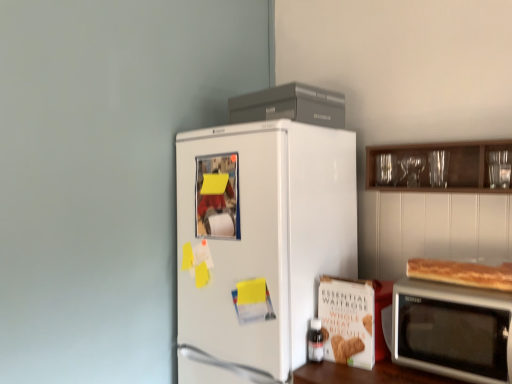
What do you see at coordinates (453, 330) in the screenshot?
I see `satin silver microwave at lower right` at bounding box center [453, 330].

The height and width of the screenshot is (384, 512). Describe the element at coordinates (462, 273) in the screenshot. I see `golden brown crusty bread at right` at that location.

Where is `matte glass bottle at lower center`? Image resolution: width=512 pixels, height=384 pixels. matte glass bottle at lower center is located at coordinates (315, 341).

From their relative heights in the image, would you say transparent glassware at upper right is taller or shorter than golden brown crusty bread at right?

transparent glassware at upper right is taller than golden brown crusty bread at right.

From a real-world perspective, is transparent glassware at upper right positioned above or below golden brown crusty bread at right?

From a real-world perspective, transparent glassware at upper right is physically above golden brown crusty bread at right.

Is transparent glassware at upper right inside the boundaries of golden brown crusty bread at right, or outside?

transparent glassware at upper right is outside golden brown crusty bread at right.

Would you say transparent glassware at upper right is a long distance from golden brown crusty bread at right?

No.

Which of these two, matte glass bottle at lower center or white matte refrigerator at center, is thinner?

Thinner between the two is matte glass bottle at lower center.

Is matte glass bottle at lower center bigger than white matte refrigerator at center?

No, matte glass bottle at lower center is not bigger than white matte refrigerator at center.

You are a GUI agent. You are given a task and a screenshot of the screen. Output one action in this format:
    pyautogui.click(x=<x>, y=<y>)
    Task: Click on the bottle below the white matte refrigerator at center (from a real-world perspective)
    This screenshot has width=512, height=384.
    Given the screenshot: What is the action you would take?
    pyautogui.click(x=315, y=341)

From the image's perspective, who appears lower, matte glass bottle at lower center or white matte refrigerator at center?

matte glass bottle at lower center appears lower in the image.

Is matte glass bottle at lower center outside of satin silver microwave at lower right?

That's correct, matte glass bottle at lower center is outside of satin silver microwave at lower right.

Which is less distant, (310, 354) or (504, 380)?

Point (310, 354) is farther from the camera than point (504, 380).

Considering the relative sizes of matte glass bottle at lower center and satin silver microwave at lower right in the image provided, is matte glass bottle at lower center wider than satin silver microwave at lower right?

No.

Is matte glass bottle at lower center to the right of transparent glassware at upper right from the viewer's perspective?

No.

From a real-world perspective, is matte glass bottle at lower center above or below transparent glassware at upper right?

matte glass bottle at lower center is below transparent glassware at upper right.

Which object is more forward, matte glass bottle at lower center or transparent glassware at upper right?

transparent glassware at upper right.

From the image's perspective, does matte glass bottle at lower center appear higher than transparent glassware at upper right?

Actually, matte glass bottle at lower center appears below transparent glassware at upper right in the image.

Choose the correct answer: Is white matte refrigerator at center inside golden brown crusty bread at right or outside it?

white matte refrigerator at center is not enclosed by golden brown crusty bread at right.

Could you tell me if white matte refrigerator at center is turned towards golden brown crusty bread at right?

No, white matte refrigerator at center does not turn towards golden brown crusty bread at right.

Is white matte refrigerator at center touching golden brown crusty bread at right?

white matte refrigerator at center and golden brown crusty bread at right are clearly separated.

Which of these two, golden brown crusty bread at right or satin silver microwave at lower right, is thinner?

With smaller width is golden brown crusty bread at right.

Relative to satin silver microwave at lower right, is golden brown crusty bread at right in front or behind?

In the image, golden brown crusty bread at right appears behind satin silver microwave at lower right.

From the image's perspective, which is below, golden brown crusty bread at right or satin silver microwave at lower right?

satin silver microwave at lower right appears lower in the image.

Image resolution: width=512 pixels, height=384 pixels. Identify the location of microwave oven that appears on the left of golden brown crusty bread at right. (453, 330).

Who is shorter, satin silver microwave at lower right or transparent glassware at upper right?

transparent glassware at upper right is shorter.

Is there a large distance between satin silver microwave at lower right and transparent glassware at upper right?

No.

From the image's perspective, between satin silver microwave at lower right and transparent glassware at upper right, who is located below?

From the image's view, satin silver microwave at lower right is below.

Can you tell me how much satin silver microwave at lower right and transparent glassware at upper right differ in facing direction?

2.78 degrees.

I want to click on food below the transparent glassware at upper right (from the image's perspective), so click(462, 273).

The image size is (512, 384). Find the location of `refrigerator above the matte glass bottle at lower center (from the image's perspective)`. refrigerator above the matte glass bottle at lower center (from the image's perspective) is located at coordinates (260, 240).

When comparing their distances from white matte refrigerator at center, does golden brown crusty bread at right or matte glass bottle at lower center seem further?

golden brown crusty bread at right is positioned further to the anchor white matte refrigerator at center.

Looking at the image, which one is located further to matte glass bottle at lower center, white matte refrigerator at center or transparent glassware at upper right?

transparent glassware at upper right lies further to matte glass bottle at lower center than the other object.

When comparing their distances from transparent glassware at upper right, does matte glass bottle at lower center or satin silver microwave at lower right seem further?

matte glass bottle at lower center lies further to transparent glassware at upper right than the other object.

When comparing their distances from transparent glassware at upper right, does white matte refrigerator at center or satin silver microwave at lower right seem closer?

Among the two, satin silver microwave at lower right is located nearer to transparent glassware at upper right.

From the image, which object appears to be farther from golden brown crusty bread at right, transparent glassware at upper right or satin silver microwave at lower right?

transparent glassware at upper right is further to golden brown crusty bread at right.

Considering their positions, is matte glass bottle at lower center positioned closer to white matte refrigerator at center than transparent glassware at upper right?

matte glass bottle at lower center lies closer to white matte refrigerator at center than the other object.

Based on their spatial positions, is matte glass bottle at lower center or satin silver microwave at lower right further from golden brown crusty bread at right?

matte glass bottle at lower center is positioned further to the anchor golden brown crusty bread at right.

Based on the photo, estimate the real-world distances between objects in this image. Which object is closer to white matte refrigerator at center, golden brown crusty bread at right or transparent glassware at upper right?

golden brown crusty bread at right is closer to white matte refrigerator at center.

At what (x,y) coordinates should I click in order to perform the action: click on microwave oven between white matte refrigerator at center and golden brown crusty bread at right in the horizontal direction. Please return your answer as a coordinate pair (x, y). The image size is (512, 384). Looking at the image, I should click on (453, 330).

In order to click on microwave oven situated between matte glass bottle at lower center and golden brown crusty bread at right from left to right in this screenshot , I will do `click(453, 330)`.

Locate an element on the screen. The width and height of the screenshot is (512, 384). food that lies between transparent glassware at upper right and matte glass bottle at lower center from top to bottom is located at coordinates (462, 273).

Identify the location of food between transparent glassware at upper right and satin silver microwave at lower right in the vertical direction. The width and height of the screenshot is (512, 384). (462, 273).